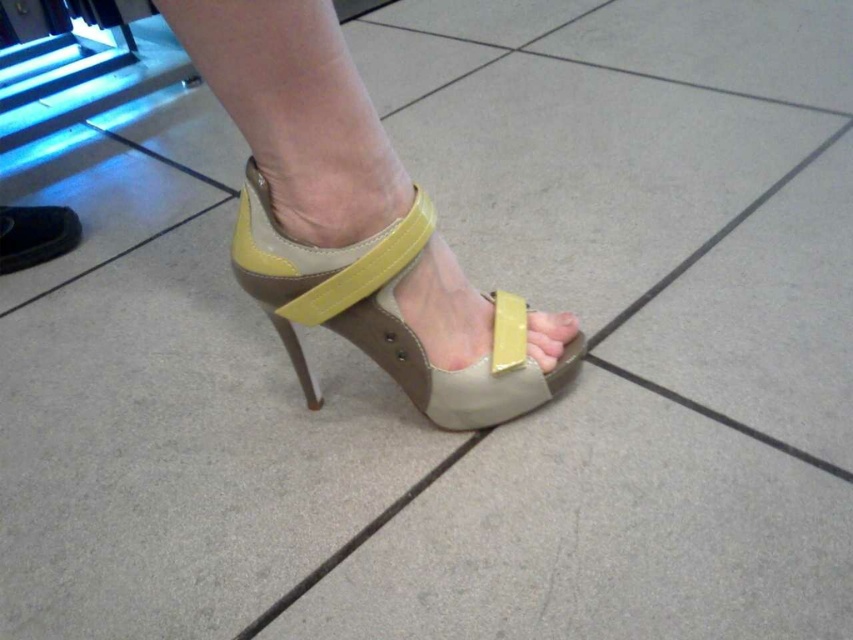
You are standing 30 inches away from the matte beige leather sandal at center. Can you reach it without moving your feet?

The matte beige leather sandal at center and viewer are 27.52 inches apart from each other, so yes, you can reach it without moving your feet since 27.52 inches is less than 30 inches.

You are a shoe designer examining the image of a high heeled sandal. You need to determine if the matte yellow leather high heel at lower center can fit inside the matte beige leather sandal at center. Based on their sizes, what do you conclude?

The matte beige leather sandal at center is larger in size than the matte yellow leather high heel at lower center, so the high heel can fit inside the sandal.